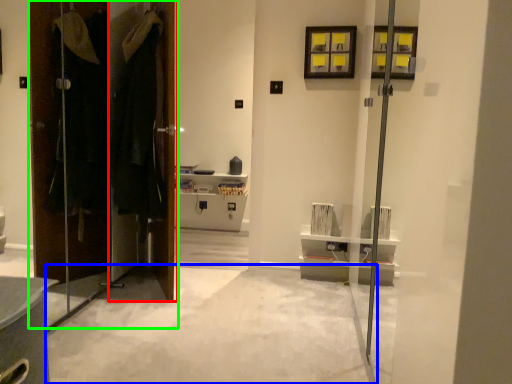
Question: Considering the real-world distances, which object is farthest from door (highlighted by a red box)? concrete (highlighted by a blue box) or door (highlighted by a green box)?

Choices:
 (A) concrete
 (B) door

Answer: (A)